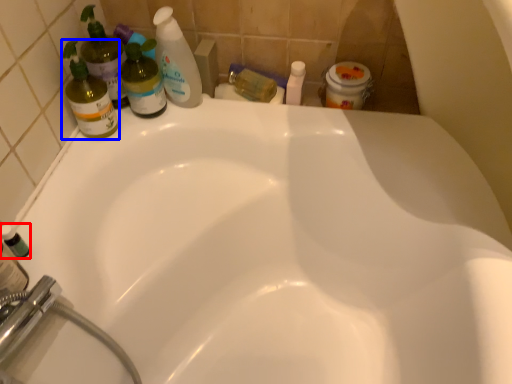
Question: Among these objects, which one is nearest to the camera, mouthwash (highlighted by a red box) or cleaning product (highlighted by a blue box)?

Choices:
 (A) mouthwash
 (B) cleaning product

Answer: (A)